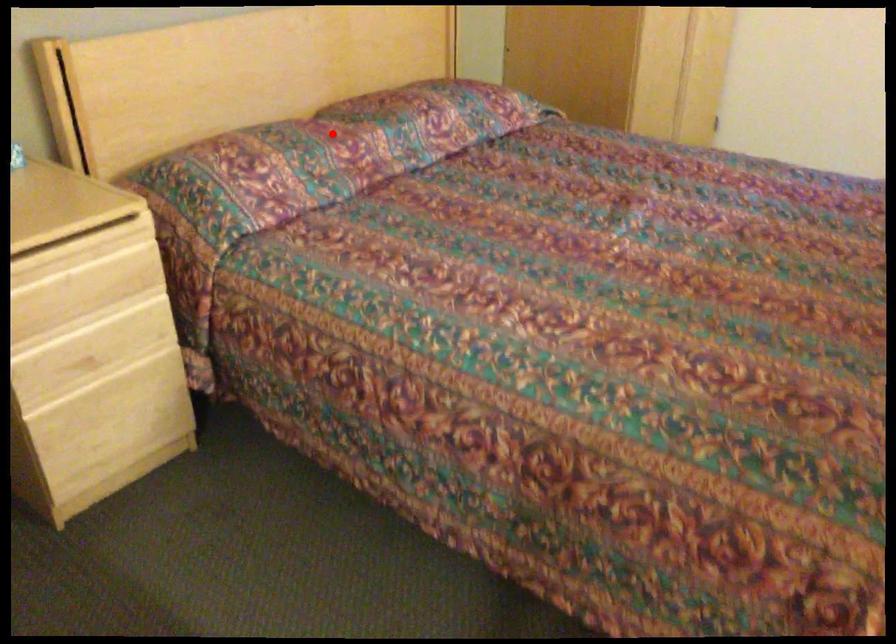
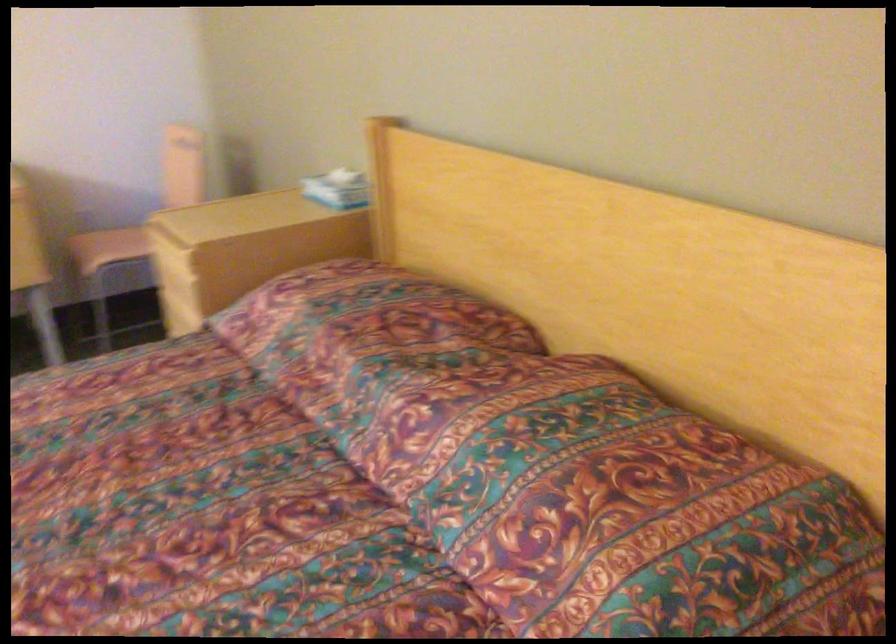
Question: I am providing you with two images of the same scene from different viewpoints. A red point is shown in image1. For the corresponding object point in image2, is it positioned nearer or farther from the camera?

Choices:
 (A) Nearer
 (B) Farther

Answer: (A)